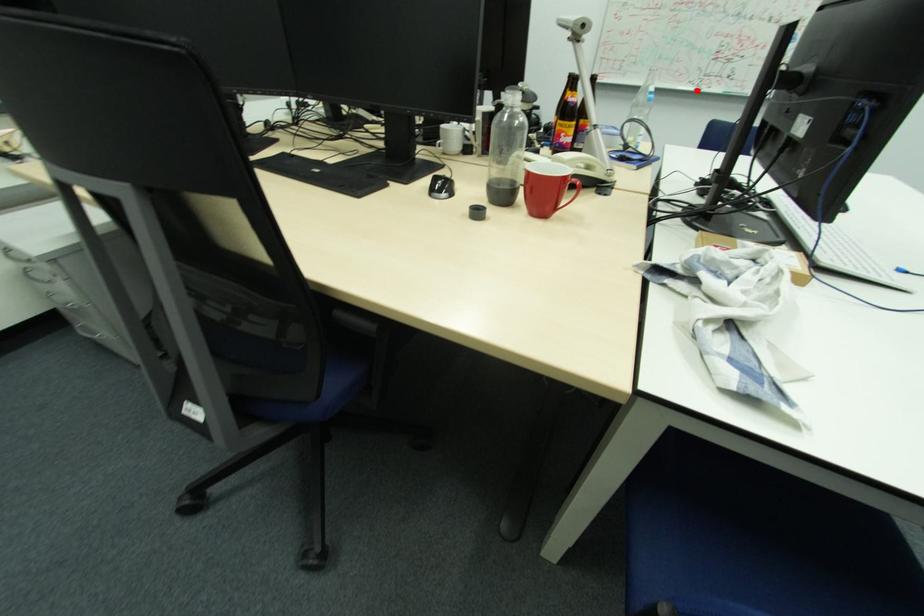
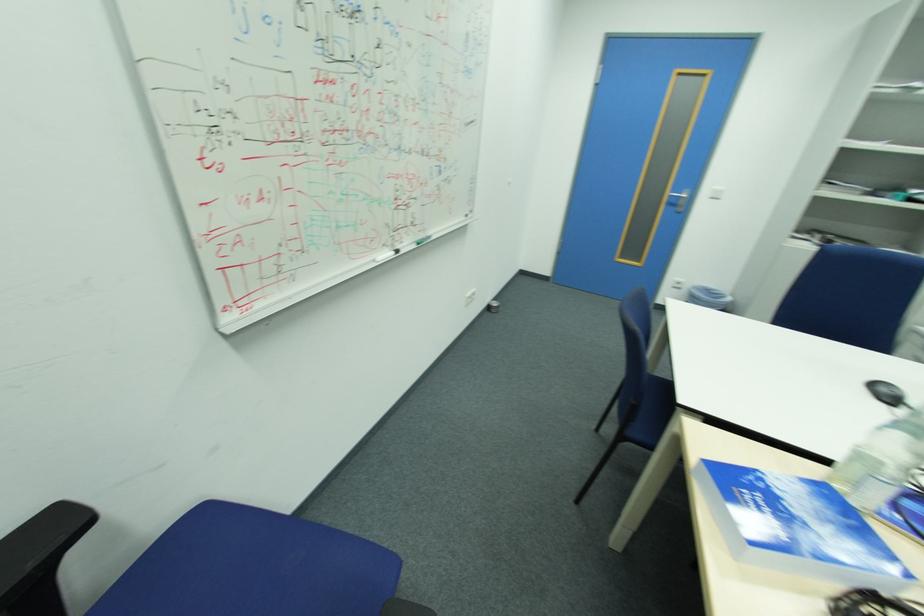
The point at the highlighted location is marked in the first image. Where is the corresponding point in the second image?

(396, 256)